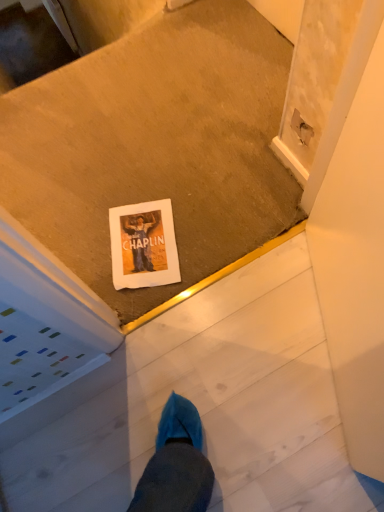
In order to click on white paper at center in this screenshot , I will do `click(143, 245)`.

Describe the element at coordinates (143, 245) in the screenshot. The width and height of the screenshot is (384, 512). I see `white paper at center` at that location.

Find the location of a particular element. white paper at center is located at coordinates (143, 245).